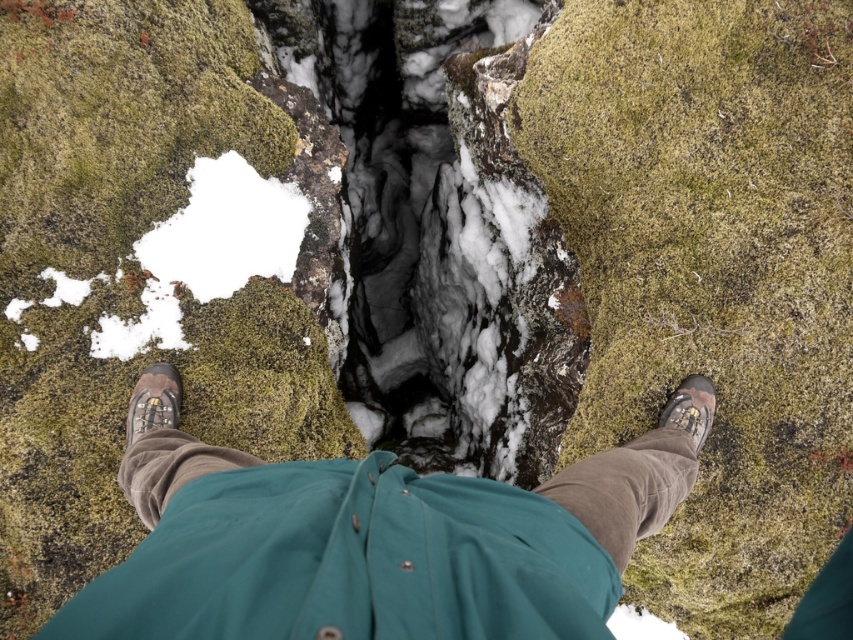
Is brown suede boots at center wider than brown suede shoe at lower left?

Indeed, brown suede boots at center has a greater width compared to brown suede shoe at lower left.

Can you confirm if brown suede boots at center is positioned above brown suede shoe at lower left?

Actually, brown suede boots at center is below brown suede shoe at lower left.

Image resolution: width=853 pixels, height=640 pixels. In order to click on brown suede boots at center in this screenshot , I will do `click(373, 545)`.

Does brown suede boots at center appear under brown suede shoe at lower right?

Correct, brown suede boots at center is located below brown suede shoe at lower right.

Between point (148, 474) and point (695, 442), which one is positioned behind?

The point (695, 442) is more distant.

Identify the location of brown suede boots at center. (373, 545).

Is brown suede shoe at lower left thinner than brown suede shoe at lower right?

In fact, brown suede shoe at lower left might be wider than brown suede shoe at lower right.

Who is positioned more to the left, brown suede shoe at lower left or brown suede shoe at lower right?

brown suede shoe at lower left is more to the left.

Identify the location of brown suede shoe at lower left. (154, 401).

This screenshot has height=640, width=853. In order to click on brown suede shoe at lower left in this screenshot , I will do `click(154, 401)`.